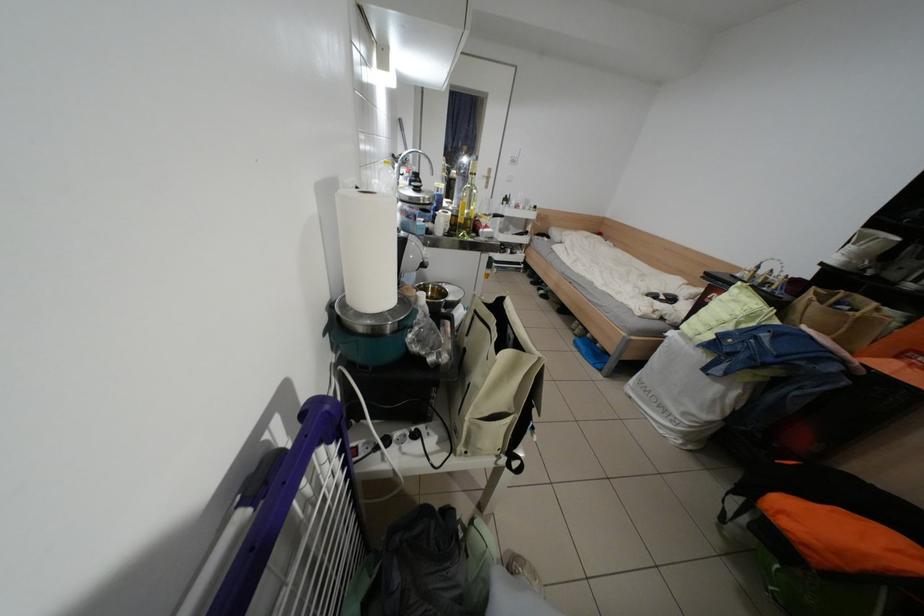
Identify the location of purple rack handle. This screenshot has width=924, height=616. (276, 505).